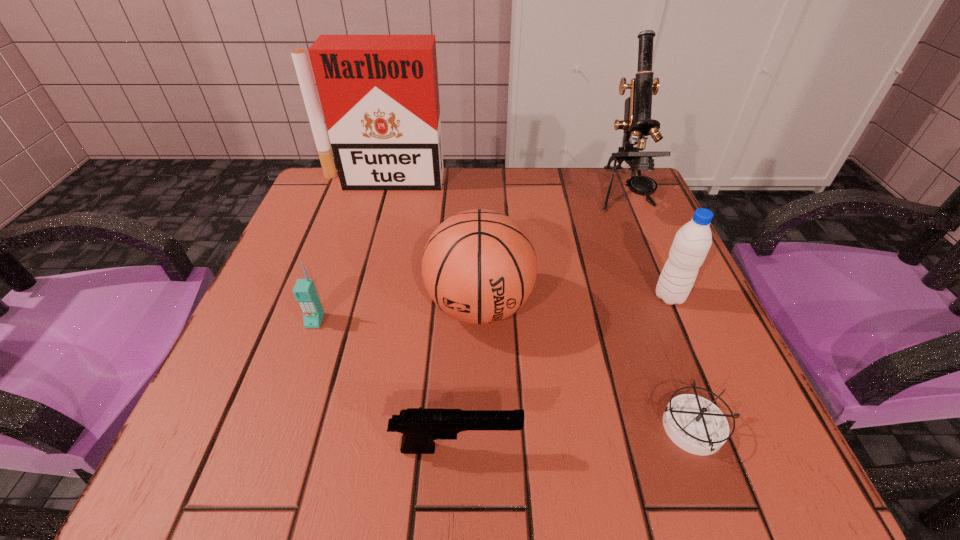
Identify the location of vacant space located on the back of the water bottle. The height and width of the screenshot is (540, 960). (634, 212).

Find the location of a particular element. free space located 0.070m on the keypad of the third shortest object is located at coordinates (300, 362).

Where is `vacant space located 0.340m on the front-facing side of the sixth tallest object`? This screenshot has height=540, width=960. vacant space located 0.340m on the front-facing side of the sixth tallest object is located at coordinates click(x=764, y=448).

Where is `vacant space located 0.110m on the back of the shortest object`? This screenshot has height=540, width=960. vacant space located 0.110m on the back of the shortest object is located at coordinates (660, 339).

You are a GUI agent. You are given a task and a screenshot of the screen. Output one action in this format:
    pyautogui.click(x=<x>, y=<y>)
    Task: Click on the microscope present at the far edge
    
    Given the screenshot: What is the action you would take?
    pyautogui.click(x=637, y=123)

I want to click on cigarette case situated at the far edge, so click(x=379, y=94).

Image resolution: width=960 pixels, height=540 pixels. What are the coordinates of `pistol that is at the near edge` in the screenshot? It's located at (419, 427).

You are a GUI agent. You are given a task and a screenshot of the screen. Output one action in this format:
    pyautogui.click(x=<x>, y=<y>)
    Task: Click on the compass located in the near edge section of the desktop
    This screenshot has width=960, height=540.
    Given the screenshot: What is the action you would take?
    pyautogui.click(x=696, y=425)

You are a GUI agent. You are given a task and a screenshot of the screen. Output one action in this format:
    pyautogui.click(x=<x>, y=<y>)
    Task: Click on the cigarette case that is at the left edge
    The image size is (960, 540).
    Given the screenshot: What is the action you would take?
    pyautogui.click(x=379, y=94)

What are the coordinates of `cellular telephone that is at the left edge` in the screenshot? It's located at (305, 292).